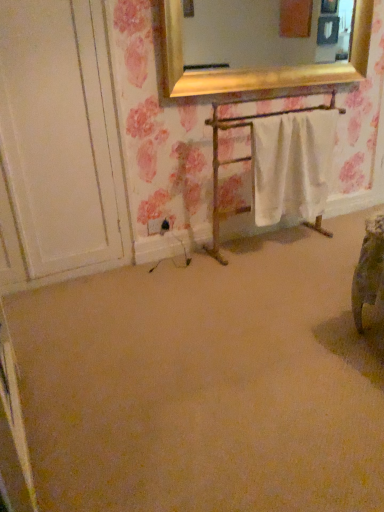
Question: From the image's perspective, is beige carpet at center positioned above or below black plastic electric outlet at lower left?

Choices:
 (A) below
 (B) above

Answer: (A)

Question: In terms of height, does beige carpet at center look taller or shorter compared to black plastic electric outlet at lower left?

Choices:
 (A) short
 (B) tall

Answer: (A)

Question: Estimate the real-world distances between objects in this image. Which object is closer to the white cotton towel at center?

Choices:
 (A) white fabric towel rack at center
 (B) black plastic electric outlet at lower left
 (C) beige carpet at center

Answer: (A)

Question: Which of these objects is positioned closest to the white fabric towel rack at center?

Choices:
 (A) beige carpet at center
 (B) black plastic electric outlet at lower left
 (C) white cotton towel at center

Answer: (C)